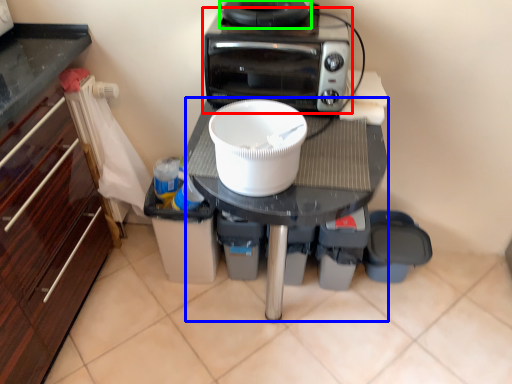
Question: Estimate the real-world distances between objects in this image. Which object is closer to home appliance (highlighted by a red box), table (highlighted by a blue box) or appliance (highlighted by a green box)?

Choices:
 (A) table
 (B) appliance

Answer: (B)